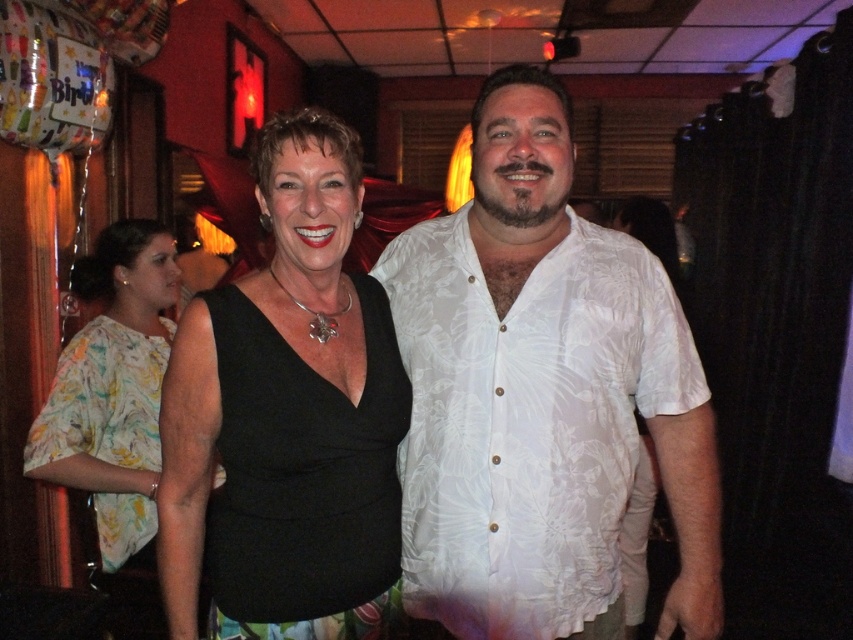
Does white floral shirt at center come behind black matte dress at center?

Yes, white floral shirt at center is further from the viewer.

Where is `white floral shirt at center`? white floral shirt at center is located at coordinates (543, 392).

Is white floral shirt at center above printed fabric dress at center?

Yes.

Is point (506, 376) positioned behind point (135, 369)?

That is False.

You are a GUI agent. You are given a task and a screenshot of the screen. Output one action in this format:
    pyautogui.click(x=<x>, y=<y>)
    Task: Click on the white floral shirt at center
    
    Given the screenshot: What is the action you would take?
    pyautogui.click(x=543, y=392)

This screenshot has height=640, width=853. Find the location of `white floral shirt at center`. white floral shirt at center is located at coordinates (543, 392).

In the scene shown: Between black matte dress at center and printed fabric dress at center, which one is positioned higher?

printed fabric dress at center is higher up.

Is black matte dress at center shorter than printed fabric dress at center?

Correct, black matte dress at center is not as tall as printed fabric dress at center.

At what (x,y) coordinates should I click in order to perform the action: click on black matte dress at center. Please return your answer as a coordinate pair (x, y). Looking at the image, I should click on (303, 480).